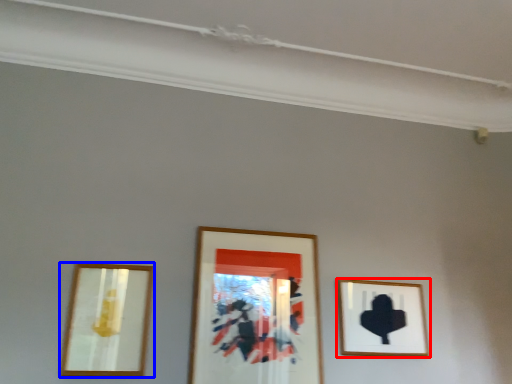
Question: Which object appears closest to the camera in this image, picture frame (highlighted by a red box) or picture frame (highlighted by a blue box)?

Choices:
 (A) picture frame
 (B) picture frame

Answer: (B)